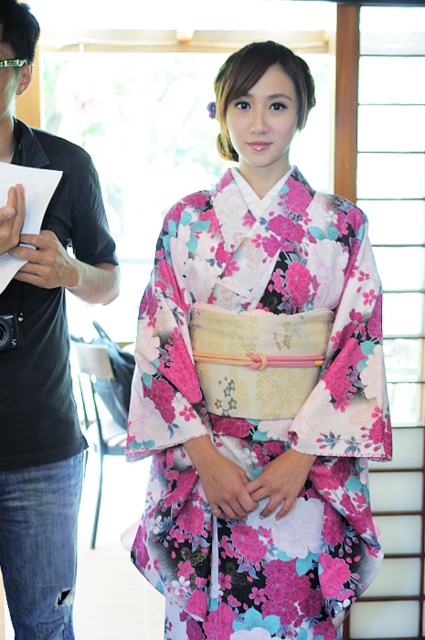
Question: Where is floral silk kimono at center located in relation to matte black shirt at left in the image?

Choices:
 (A) right
 (B) left

Answer: (A)

Question: Which point is closer to the camera?

Choices:
 (A) matte black shirt at left
 (B) floral silk kimono at center

Answer: (A)

Question: In this image, where is floral silk kimono at center located relative to matte black shirt at left?

Choices:
 (A) left
 (B) right

Answer: (B)

Question: Does floral silk kimono at center have a greater width compared to matte black shirt at left?

Choices:
 (A) no
 (B) yes

Answer: (B)